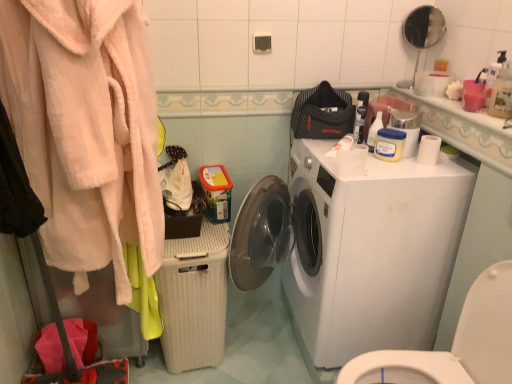
Where is `vacant area that lies in front of matte plastic container at upper right`? The image size is (512, 384). vacant area that lies in front of matte plastic container at upper right is located at coordinates (405, 170).